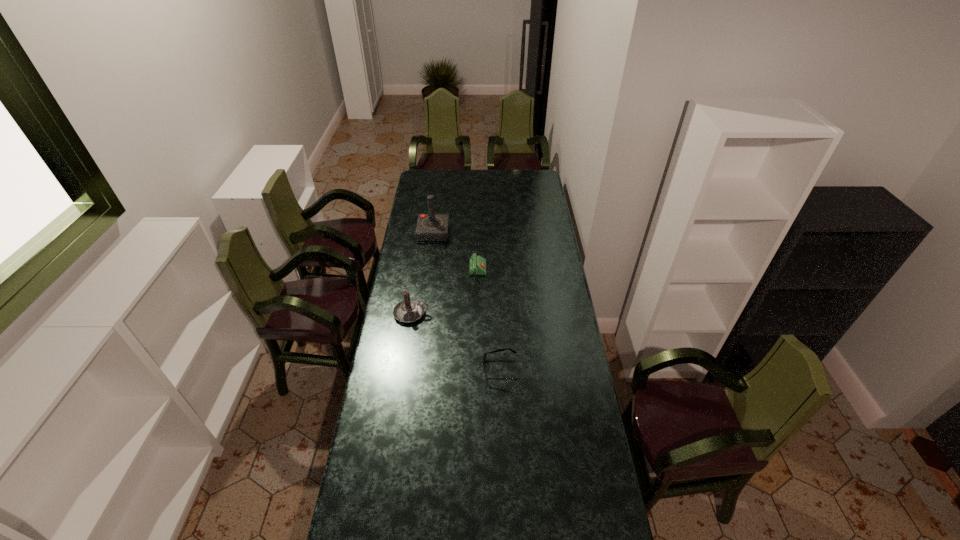
Identify the location of free space located on the dial of the third nearest object. Image resolution: width=960 pixels, height=540 pixels. pos(542,276).

Where is `free location located on the lenses of the nearest object`? The width and height of the screenshot is (960, 540). free location located on the lenses of the nearest object is located at coordinates (433, 370).

The width and height of the screenshot is (960, 540). I want to click on free space located 0.150m on the lenses of the nearest object, so click(445, 370).

Locate an element on the screen. The image size is (960, 540). blank area located 0.160m on the lenses of the nearest object is located at coordinates (443, 370).

Where is `joystick that is at the left edge`? The image size is (960, 540). joystick that is at the left edge is located at coordinates (430, 227).

Identify the location of candle that is at the left edge. This screenshot has height=540, width=960. (409, 310).

Locate an element on the screen. The image size is (960, 540). vacant space at the far edge of the desktop is located at coordinates (460, 173).

Locate an element on the screen. free space at the left edge of the desktop is located at coordinates (402, 240).

Find the location of `free space at the right edge of the desktop`. free space at the right edge of the desktop is located at coordinates (567, 406).

Image resolution: width=960 pixels, height=540 pixels. In order to click on vacant space at the far right corner of the desktop in this screenshot , I will do `click(532, 174)`.